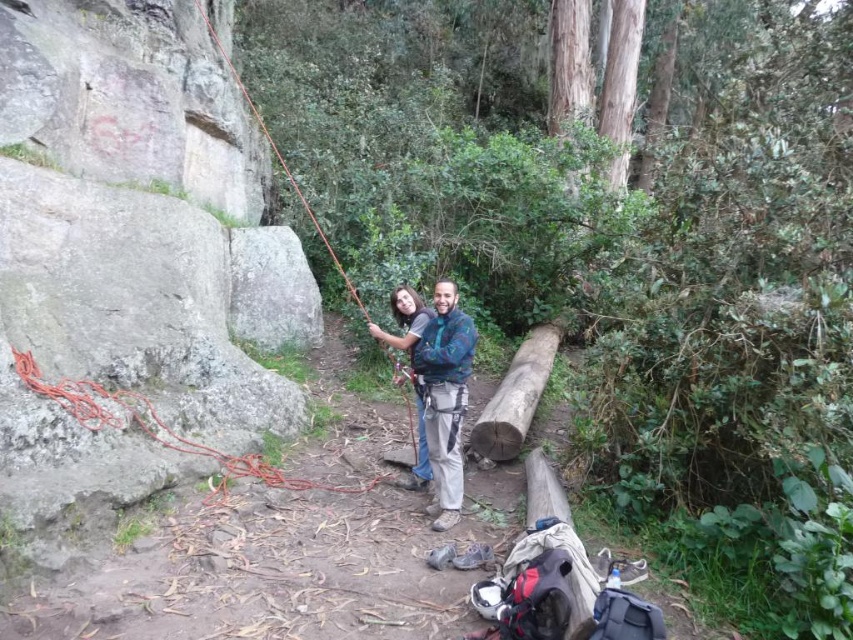
Who is shorter, blue patterned shirt at center or orange rope at left?

orange rope at left is shorter.

What are the coordinates of `blue patterned shirt at center` in the screenshot? It's located at (444, 396).

This screenshot has height=640, width=853. Identify the location of blue patterned shirt at center. (444, 396).

Between point (184, 442) and point (474, 442), which one is positioned in front?

Point (184, 442) is in front.

Does point (115, 413) lie in front of point (492, 458)?

Yes.

Locate an element on the screen. The width and height of the screenshot is (853, 640). orange rope at left is located at coordinates (158, 426).

Is blue patterned shirt at center closer to camera compared to smooth brown log at center?

Yes.

Between point (469, 317) and point (479, 420), which one is positioned in front?

Positioned in front is point (479, 420).

At what (x,y) coordinates should I click in order to perform the action: click on blue patterned shirt at center. Please return your answer as a coordinate pair (x, y). Looking at the image, I should click on (444, 396).